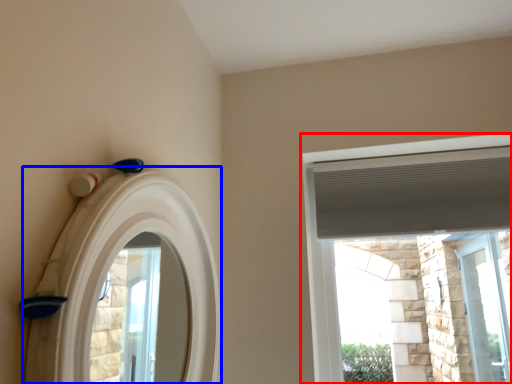
Question: Which of the following is the farthest to the observer, window (highlighted by a red box) or archway (highlighted by a blue box)?

Choices:
 (A) window
 (B) archway

Answer: (A)